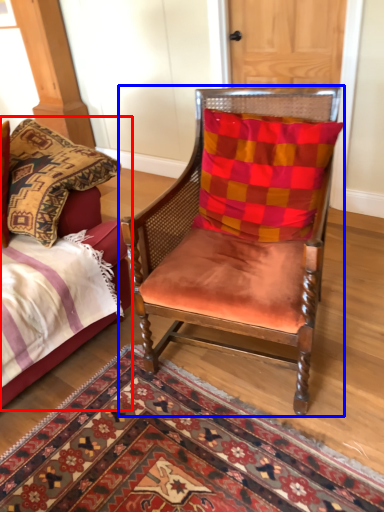
Question: Among these objects, which one is nearest to the camera, bed (highlighted by a red box) or chair (highlighted by a blue box)?

Choices:
 (A) bed
 (B) chair

Answer: (B)